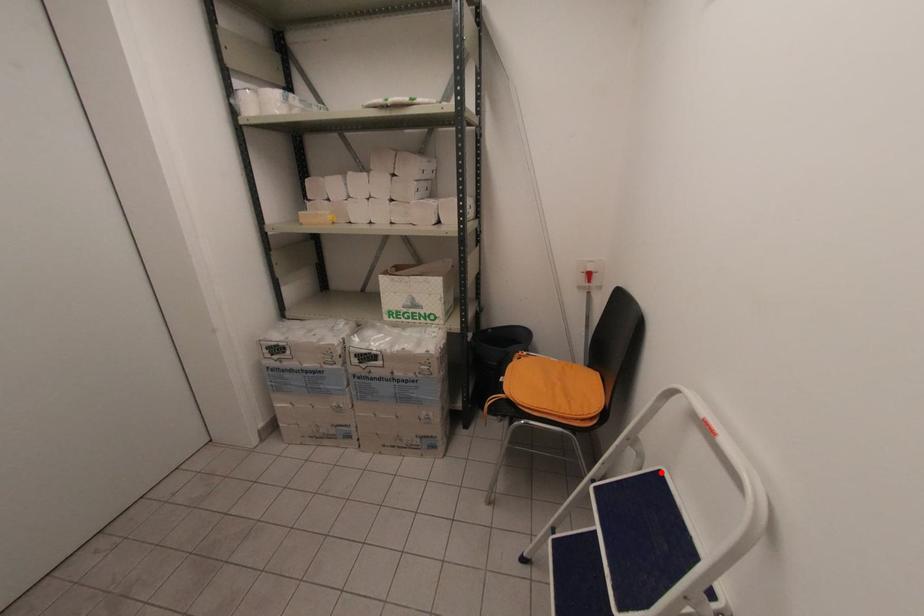
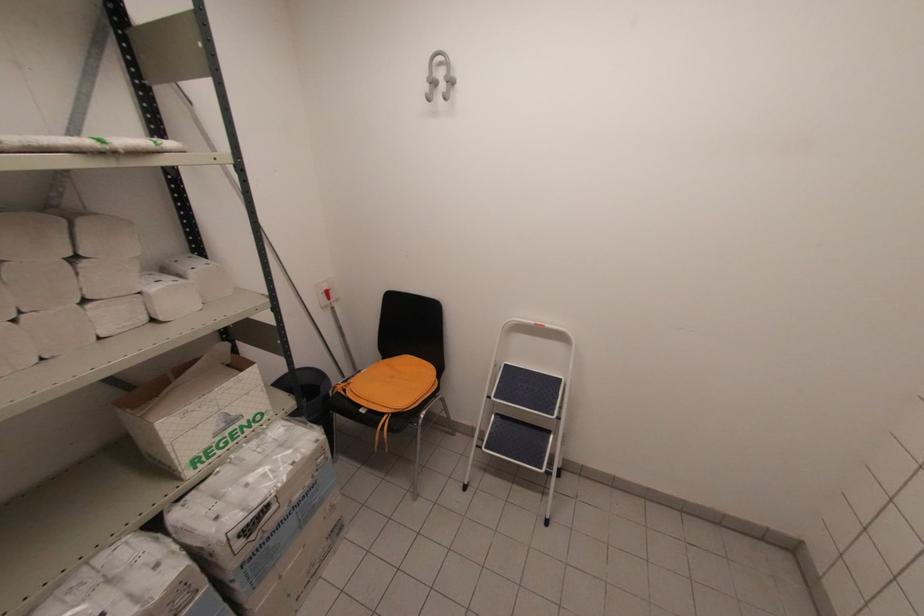
The point at the highlighted location is marked in the first image. Where is the corresponding point in the second image?

(506, 366)